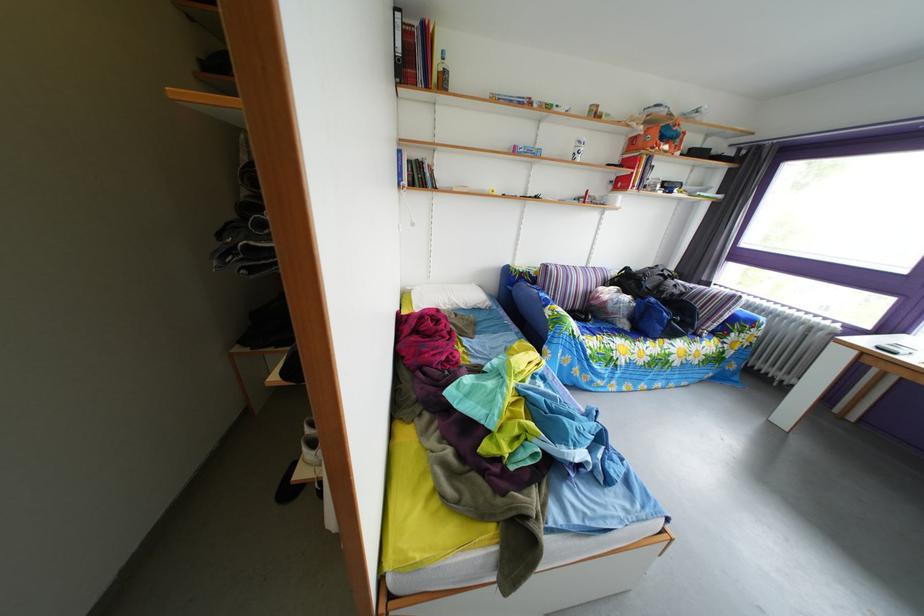
Image resolution: width=924 pixels, height=616 pixels. Identify the location of blue sofa armrest. (531, 306).